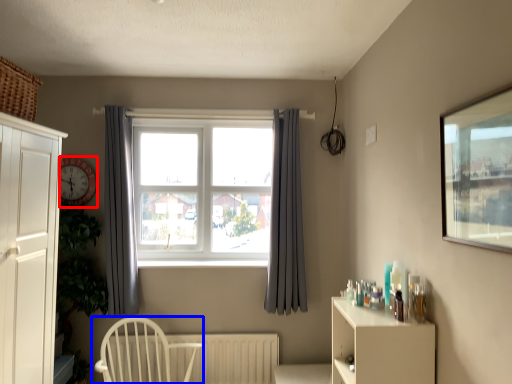
Question: Which object appears farthest to the camera in this image, clock (highlighted by a red box) or chair (highlighted by a blue box)?

Choices:
 (A) clock
 (B) chair

Answer: (A)